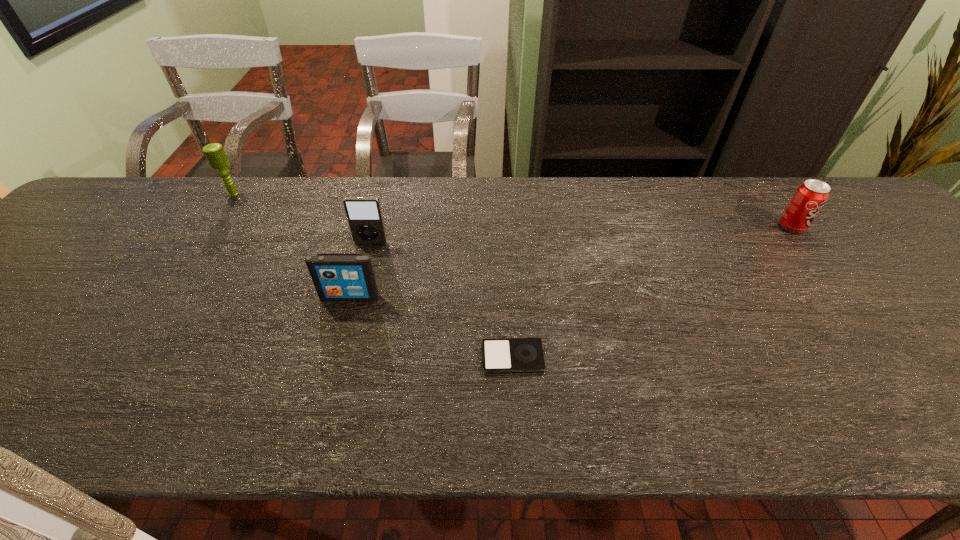
The height and width of the screenshot is (540, 960). I want to click on the leftmost object, so click(214, 152).

Locate an element on the screen. The height and width of the screenshot is (540, 960). microphone is located at coordinates (214, 152).

This screenshot has width=960, height=540. What are the coordinates of `the farthest iPod` in the screenshot? It's located at (364, 214).

Locate an element on the screen. soda is located at coordinates (810, 197).

Image resolution: width=960 pixels, height=540 pixels. I want to click on the fourth nearest object, so click(x=810, y=197).

The height and width of the screenshot is (540, 960). Identify the location of the fourth farthest object. (336, 276).

You are a GUI agent. You are given a task and a screenshot of the screen. Output one action in this format:
    pyautogui.click(x=<x>, y=<y>)
    Task: Click on the nearest iPod
    This screenshot has height=540, width=960.
    Given the screenshot: What is the action you would take?
    pyautogui.click(x=502, y=355)

I want to click on the rightmost iPod, so click(502, 355).

At what (x,y) coordinates should I click in order to perform the action: click on vacant space located 0.300m on the left of the leftmost object. Please return your answer as a coordinate pair (x, y). Looking at the image, I should click on coord(124,194).

Identify the location of vacant space positioned 0.370m on the front-facing side of the third nearest object. Image resolution: width=960 pixels, height=540 pixels. point(339,367).